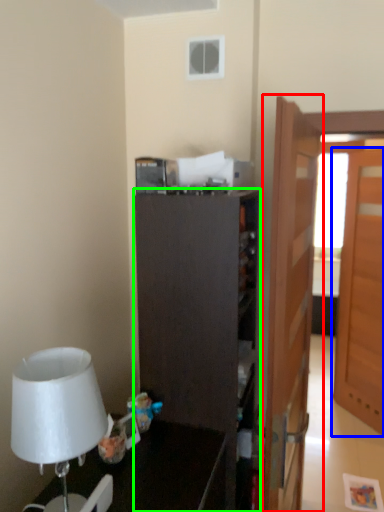
Question: Which is farther away from door (highlighted by a red box)? door (highlighted by a blue box) or cabinetry (highlighted by a green box)?

Choices:
 (A) door
 (B) cabinetry

Answer: (A)